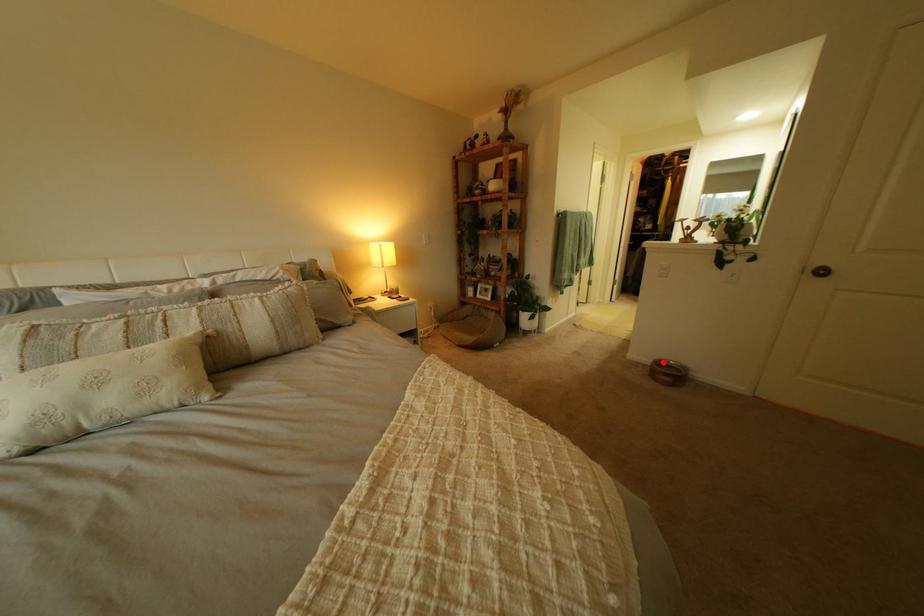
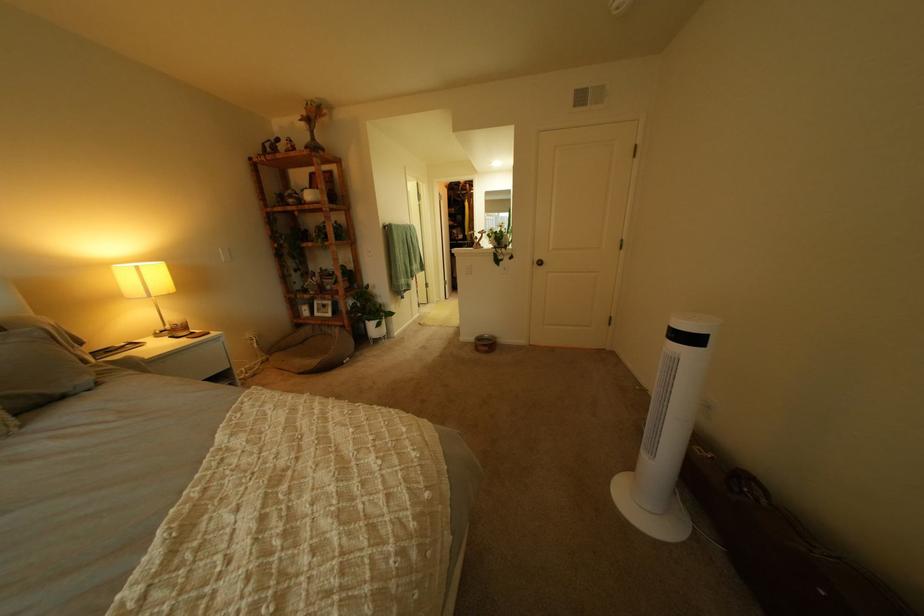
Question: A red point is marked in image1. In image2, is the corresponding 3D point closer to the camera or farther? Reply with the corresponding letter.

Choices:
 (A) The corresponding 3D point is closer.
 (B) The corresponding 3D point is farther.

Answer: (B)